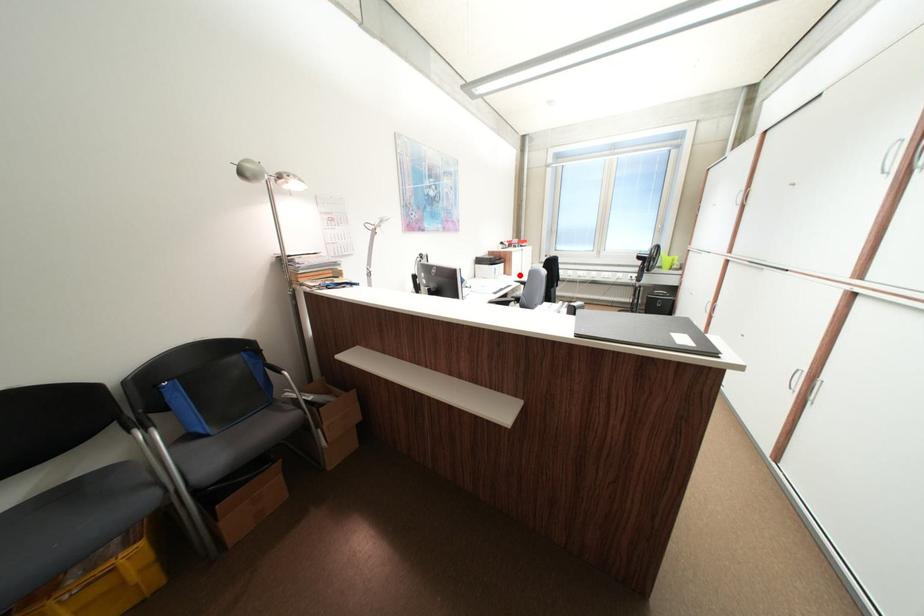
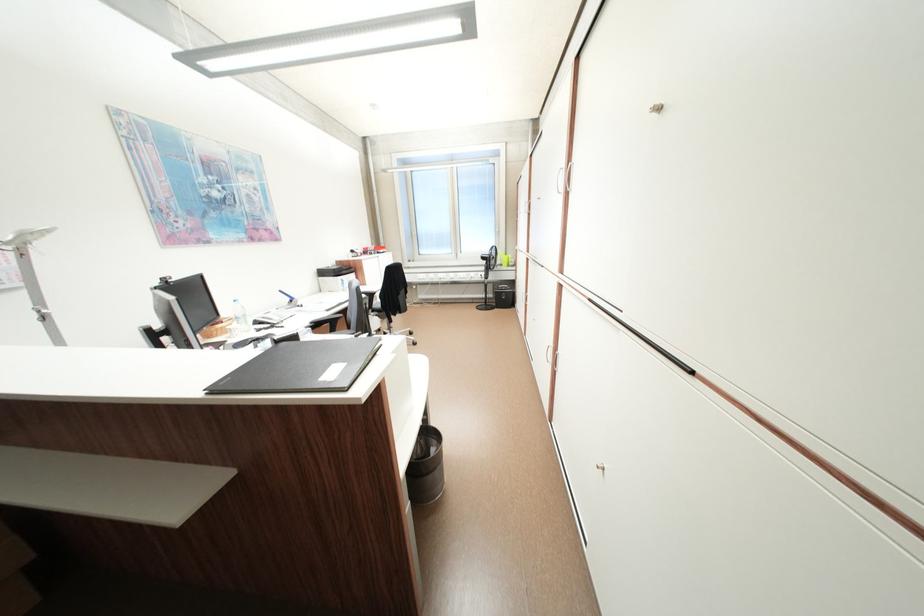
Find the pixel in the second image that matches the highlighted location in the first image.

(373, 285)